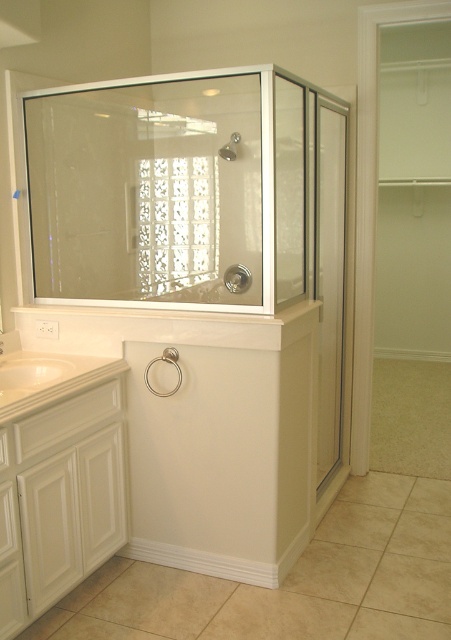
Question: Which point is closer to the camera?

Choices:
 (A) (235, 148)
 (B) (331, 435)

Answer: (B)

Question: Can you confirm if clear glass screen door at right is positioned above clear glass shower at center?

Choices:
 (A) yes
 (B) no

Answer: (B)

Question: Is clear glass screen door at right positioned in front of white glossy faucet at upper left?

Choices:
 (A) no
 (B) yes

Answer: (A)

Question: Which point is closer to the camera?

Choices:
 (A) (0, 342)
 (B) (326, 276)
 (C) (226, 160)

Answer: (A)

Question: Which point is farther from the camera taking this photo?

Choices:
 (A) (0, 344)
 (B) (230, 147)

Answer: (B)

Question: Observing the image, what is the correct spatial positioning of clear glass screen door at right in reference to white glossy faucet at upper left?

Choices:
 (A) right
 (B) left

Answer: (A)